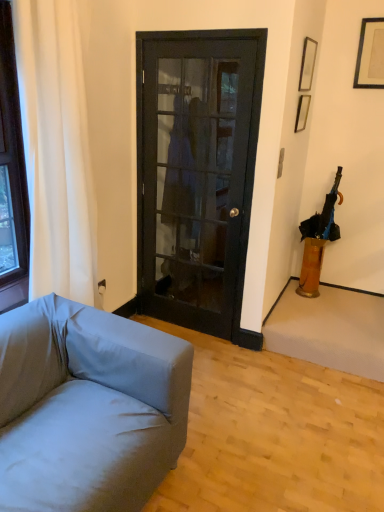
Measure the distance between light gray fabric couch at lower left and camera.

A distance of 1.28 meters exists between light gray fabric couch at lower left and camera.

You are a GUI agent. You are given a task and a screenshot of the screen. Output one action in this format:
    pyautogui.click(x=<x>, y=<y>)
    Task: Click on the metallic gold picture frame at upper right, arranged as the first picture frame when viewed from the left
    This screenshot has width=384, height=512.
    Given the screenshot: What is the action you would take?
    pyautogui.click(x=302, y=112)

Measure the distance between white fabric curtain at left and camera.

The distance of white fabric curtain at left from camera is 5.95 feet.

What do you see at coordinates (324, 216) in the screenshot? The width and height of the screenshot is (384, 512). I see `black fabric umbrella at right` at bounding box center [324, 216].

Identify the location of matte black picture frame at upper right, which appears as the second picture frame when viewed from the right. (307, 64).

Describe the element at coordinates (370, 55) in the screenshot. I see `black matte picture frame at upper right, the 3th picture frame in the left-to-right sequence` at that location.

Where is `light gray fabric couch at lower left`? Image resolution: width=384 pixels, height=512 pixels. light gray fabric couch at lower left is located at coordinates (87, 408).

Find the location of a particular element. The height and width of the screenshot is (512, 384). the 1st picture frame counting from the right side of the metallic gold picture frame at upper right, which is counted as the third picture frame, starting from the right is located at coordinates (307, 64).

Is metallic gold picture frame at upper right, arranged as the first picture frame when viewed from the left, at the right side of matte black picture frame at upper right, which appears as the second picture frame when viewed from the right?

In fact, metallic gold picture frame at upper right, arranged as the first picture frame when viewed from the left, is to the left of matte black picture frame at upper right, which appears as the second picture frame when viewed from the right.

Can you confirm if metallic gold picture frame at upper right, which is counted as the third picture frame, starting from the right, is thinner than matte black picture frame at upper right, which appears as the second picture frame when viewed from the right?

In fact, metallic gold picture frame at upper right, which is counted as the third picture frame, starting from the right, might be wider than matte black picture frame at upper right, which appears as the second picture frame when viewed from the right.

Does metallic gold picture frame at upper right, which is counted as the third picture frame, starting from the right, turn towards matte black picture frame at upper right, the 2th picture frame in the left-to-right sequence?

No.

Can you see light gray fabric couch at lower left touching black glass door at center?

No, light gray fabric couch at lower left is not next to black glass door at center.

From the image's perspective, which object appears higher, light gray fabric couch at lower left or black glass door at center?

black glass door at center.

Does point (89, 333) appear closer or farther from the camera than point (232, 314)?

Point (89, 333).

Considering the relative sizes of light gray fabric couch at lower left and black glass door at center in the image provided, is light gray fabric couch at lower left wider than black glass door at center?

Yes, light gray fabric couch at lower left is wider than black glass door at center.

How far apart are black matte picture frame at upper right, the 3th picture frame in the left-to-right sequence, and black glass door at center?

They are 1.43 meters apart.

Do you think black matte picture frame at upper right, the 1th picture frame when ordered from right to left, is within black glass door at center, or outside of it?

black matte picture frame at upper right, the 1th picture frame when ordered from right to left, cannot be found inside black glass door at center.

Based on their positions, is black matte picture frame at upper right, the 1th picture frame when ordered from right to left, located to the left or right of black glass door at center?

In the image, black matte picture frame at upper right, the 1th picture frame when ordered from right to left, appears on the right side of black glass door at center.

Between black matte picture frame at upper right, the 1th picture frame when ordered from right to left, and black glass door at center, which one is positioned behind?

black matte picture frame at upper right, the 1th picture frame when ordered from right to left, is more distant.

Is metallic gold picture frame at upper right, arranged as the first picture frame when viewed from the left, completely or partially inside black matte picture frame at upper right, the 1th picture frame when ordered from right to left?

No, metallic gold picture frame at upper right, arranged as the first picture frame when viewed from the left, is located outside of black matte picture frame at upper right, the 1th picture frame when ordered from right to left.

Consider the image. From the image's perspective, between black matte picture frame at upper right, the 1th picture frame when ordered from right to left, and metallic gold picture frame at upper right, arranged as the first picture frame when viewed from the left, who is located below?

metallic gold picture frame at upper right, arranged as the first picture frame when viewed from the left.

Does black matte picture frame at upper right, the 1th picture frame when ordered from right to left, touch metallic gold picture frame at upper right, which is counted as the third picture frame, starting from the right?

There is a gap between black matte picture frame at upper right, the 1th picture frame when ordered from right to left, and metallic gold picture frame at upper right, which is counted as the third picture frame, starting from the right.

From a real-world perspective, starting from the metallic gold picture frame at upper right, arranged as the first picture frame when viewed from the left, which picture frame is the 2nd one vertically above it? Please provide its 2D coordinates.

[(370, 55)]

Can you confirm if black matte picture frame at upper right, the 3th picture frame in the left-to-right sequence, is thinner than translucent amber vase at right?

Yes, black matte picture frame at upper right, the 3th picture frame in the left-to-right sequence, is thinner than translucent amber vase at right.

From the image's perspective, relative to translucent amber vase at right, is black matte picture frame at upper right, the 1th picture frame when ordered from right to left, above or below?

black matte picture frame at upper right, the 1th picture frame when ordered from right to left, is situated higher than translucent amber vase at right in the image.

Considering the positions of objects black matte picture frame at upper right, the 3th picture frame in the left-to-right sequence, and translucent amber vase at right in the image provided, who is more to the left, black matte picture frame at upper right, the 3th picture frame in the left-to-right sequence, or translucent amber vase at right?

From the viewer's perspective, translucent amber vase at right appears more on the left side.

Image resolution: width=384 pixels, height=512 pixels. I want to click on the 3rd picture frame located above the translucent amber vase at right (from a real-world perspective), so click(370, 55).

In terms of height, does matte black picture frame at upper right, which appears as the second picture frame when viewed from the right, look taller or shorter compared to white fabric curtain at left?

Clearly, matte black picture frame at upper right, which appears as the second picture frame when viewed from the right, is shorter compared to white fabric curtain at left.

Is matte black picture frame at upper right, which appears as the second picture frame when viewed from the right, next to white fabric curtain at left?

matte black picture frame at upper right, which appears as the second picture frame when viewed from the right, and white fabric curtain at left are not in contact.

Choose the correct answer: Is matte black picture frame at upper right, which appears as the second picture frame when viewed from the right, inside white fabric curtain at left or outside it?

matte black picture frame at upper right, which appears as the second picture frame when viewed from the right, exists outside the volume of white fabric curtain at left.

Is translucent amber vase at right spatially inside metallic gold picture frame at upper right, arranged as the first picture frame when viewed from the left, or outside of it?

translucent amber vase at right is not enclosed by metallic gold picture frame at upper right, arranged as the first picture frame when viewed from the left.

Could you tell me if translucent amber vase at right is turned towards metallic gold picture frame at upper right, which is counted as the third picture frame, starting from the right?

No, translucent amber vase at right is not facing towards metallic gold picture frame at upper right, which is counted as the third picture frame, starting from the right.

From a real-world perspective, is translucent amber vase at right on metallic gold picture frame at upper right, which is counted as the third picture frame, starting from the right?

No, from a real-world perspective, translucent amber vase at right is not over metallic gold picture frame at upper right, which is counted as the third picture frame, starting from the right

Image resolution: width=384 pixels, height=512 pixels. What are the coordinates of `picture frame lying below the matte black picture frame at upper right, the 2th picture frame in the left-to-right sequence (from the image's perspective)` in the screenshot? It's located at (302, 112).

Image resolution: width=384 pixels, height=512 pixels. What are the coordinates of `studio couch located in front of the black glass door at center` in the screenshot? It's located at (87, 408).

Based on their spatial positions, is light gray fabric couch at lower left or black glass door at center further from white fabric curtain at left?

black glass door at center is further to white fabric curtain at left.

Which object lies further to the anchor point metallic gold picture frame at upper right, arranged as the first picture frame when viewed from the left, translucent amber vase at right or black fabric umbrella at right?

The object further to metallic gold picture frame at upper right, arranged as the first picture frame when viewed from the left, is translucent amber vase at right.

Consider the image. When comparing their distances from matte black picture frame at upper right, which appears as the second picture frame when viewed from the right, does translucent amber vase at right or black fabric umbrella at right seem closer?

Among the two, black fabric umbrella at right is located nearer to matte black picture frame at upper right, which appears as the second picture frame when viewed from the right.

Estimate the real-world distances between objects in this image. Which object is closer to black fabric umbrella at right, black glass door at center or translucent amber vase at right?

translucent amber vase at right is positioned closer to the anchor black fabric umbrella at right.

Which object lies further to the anchor point black fabric umbrella at right, black glass door at center or metallic gold picture frame at upper right, which is counted as the third picture frame, starting from the right?

black glass door at center is positioned further to the anchor black fabric umbrella at right.

Considering their positions, is black glass door at center positioned closer to black fabric umbrella at right than light gray fabric couch at lower left?

black glass door at center.

From the image, which object appears to be farther from metallic gold picture frame at upper right, arranged as the first picture frame when viewed from the left, black matte picture frame at upper right, the 3th picture frame in the left-to-right sequence, or matte black picture frame at upper right, which appears as the second picture frame when viewed from the right?

black matte picture frame at upper right, the 3th picture frame in the left-to-right sequence, lies further to metallic gold picture frame at upper right, arranged as the first picture frame when viewed from the left, than the other object.

When comparing their distances from black matte picture frame at upper right, the 3th picture frame in the left-to-right sequence, does matte black picture frame at upper right, the 2th picture frame in the left-to-right sequence, or translucent amber vase at right seem further?

Among the two, translucent amber vase at right is located further to black matte picture frame at upper right, the 3th picture frame in the left-to-right sequence.

Identify the location of picture frame between matte black picture frame at upper right, the 2th picture frame in the left-to-right sequence, and black fabric umbrella at right in the up-down direction. (302, 112).

Where is `picture frame situated between black glass door at center and matte black picture frame at upper right, which appears as the second picture frame when viewed from the right, from left to right`? picture frame situated between black glass door at center and matte black picture frame at upper right, which appears as the second picture frame when viewed from the right, from left to right is located at coordinates (302, 112).

Locate an element on the screen. door located between light gray fabric couch at lower left and metallic gold picture frame at upper right, which is counted as the third picture frame, starting from the right, in the depth direction is located at coordinates (197, 175).

Find the location of `door located between white fabric curtain at left and black matte picture frame at upper right, the 3th picture frame in the left-to-right sequence, in the left-right direction`. door located between white fabric curtain at left and black matte picture frame at upper right, the 3th picture frame in the left-to-right sequence, in the left-right direction is located at coordinates (197, 175).